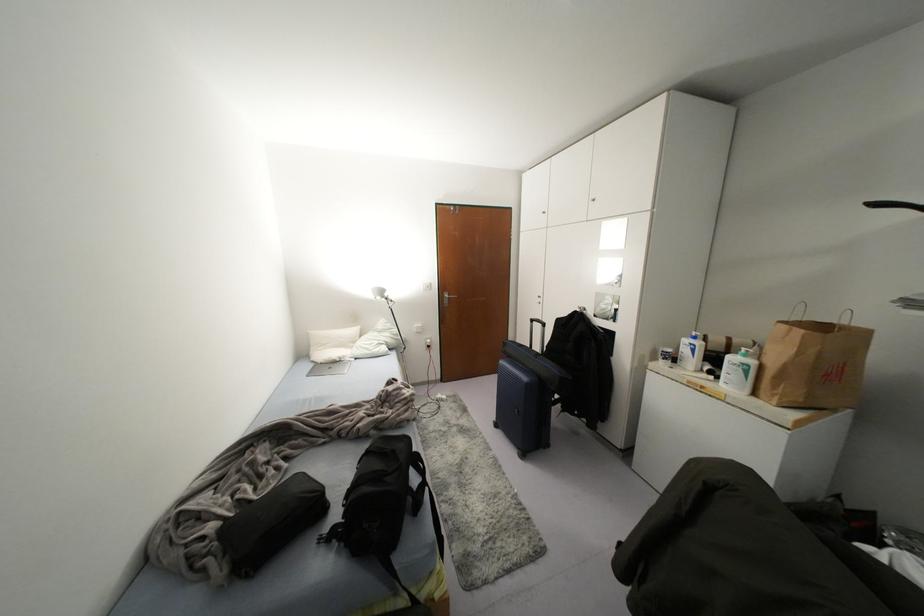
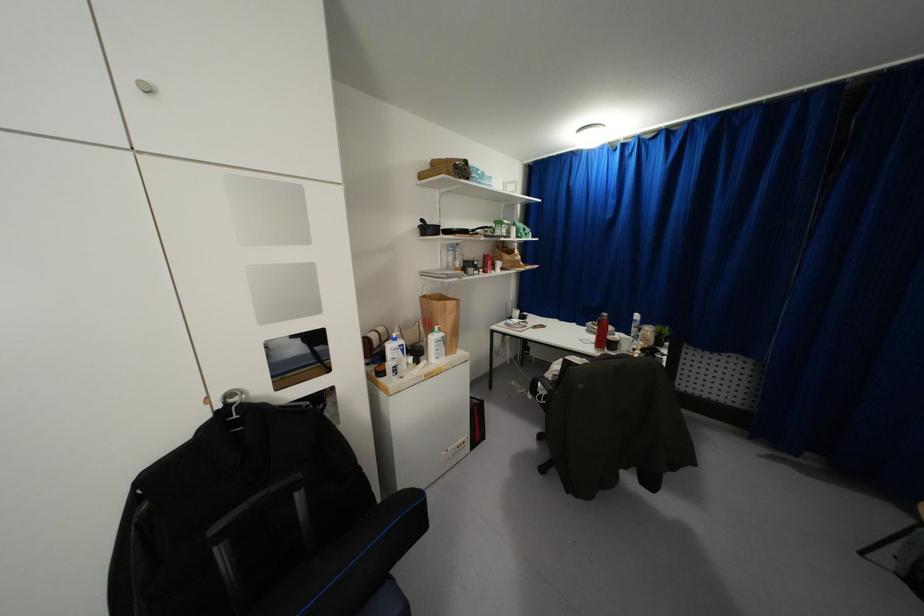
Locate, in the second image, the point that corresponds to point 691,350 in the first image.

(402, 350)